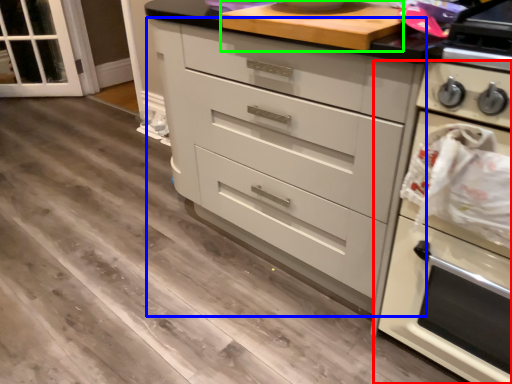
Question: Which is nearer to the home appliance (highlighted by a red box)? chest of drawers (highlighted by a blue box) or appliance (highlighted by a green box).

Choices:
 (A) chest of drawers
 (B) appliance

Answer: (A)